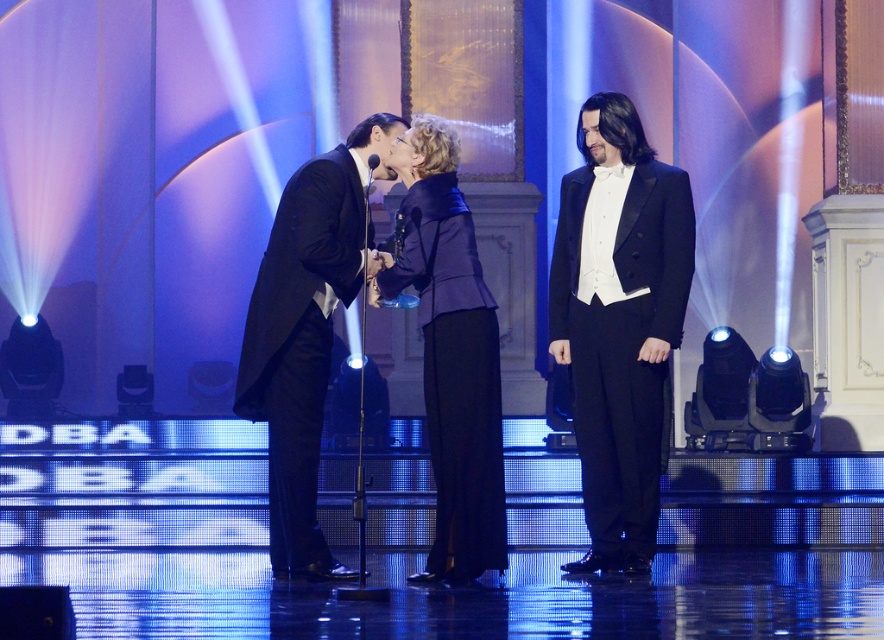
Does black satin tuxedo at left appear under velvet blue blazer at center?

Actually, black satin tuxedo at left is above velvet blue blazer at center.

Who is more forward, (334, 148) or (440, 506)?

Point (440, 506)

Who is more distant from viewer, (261, 321) or (479, 538)?

The point (261, 321) is more distant.

Identify the location of black satin tuxedo at left. The height and width of the screenshot is (640, 884). (307, 330).

Can you confirm if black satin tuxedo at right is positioned above velvet blue blazer at center?

Correct, black satin tuxedo at right is located above velvet blue blazer at center.

Which is below, black satin tuxedo at right or velvet blue blazer at center?

velvet blue blazer at center

Is point (612, 140) more distant than point (486, 300)?

That is True.

The height and width of the screenshot is (640, 884). Find the location of `black satin tuxedo at right`. black satin tuxedo at right is located at coordinates (619, 323).

Which of these two, black satin tuxedo at right or black satin tuxedo at left, stands shorter?

Standing shorter between the two is black satin tuxedo at left.

Does point (641, 561) come in front of point (256, 410)?

No, (641, 561) is behind (256, 410).

Locate an element on the screen. The width and height of the screenshot is (884, 640). black satin tuxedo at right is located at coordinates (619, 323).